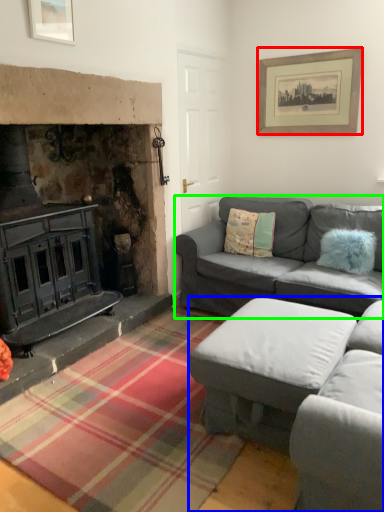
Question: Which object is the closest to the picture frame (highlighted by a red box)? Choose among these: studio couch (highlighted by a blue box) or studio couch (highlighted by a green box).

Choices:
 (A) studio couch
 (B) studio couch

Answer: (B)